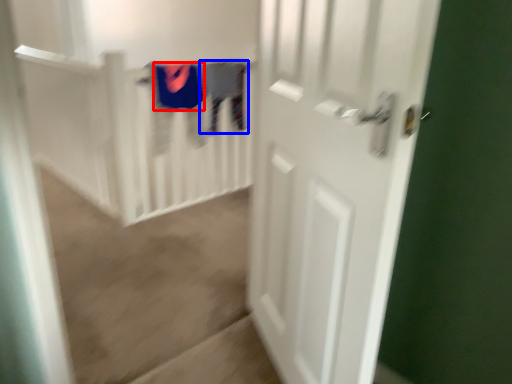
Question: Among these objects, which one is farthest to the camera, clothing (highlighted by a red box) or clothing (highlighted by a blue box)?

Choices:
 (A) clothing
 (B) clothing

Answer: (B)